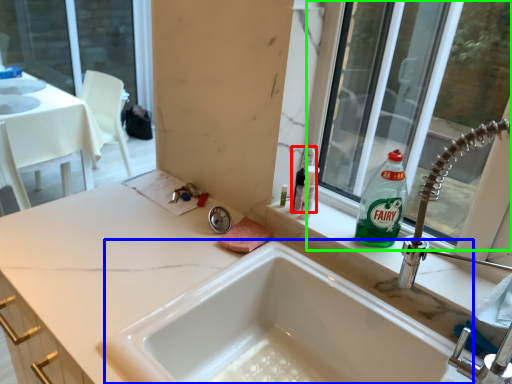
Question: Estimate the real-world distances between objects in this image. Which object is closer to toiletry (highlighted by a red box), tub (highlighted by a blue box) or window (highlighted by a green box)?

Choices:
 (A) tub
 (B) window

Answer: (A)